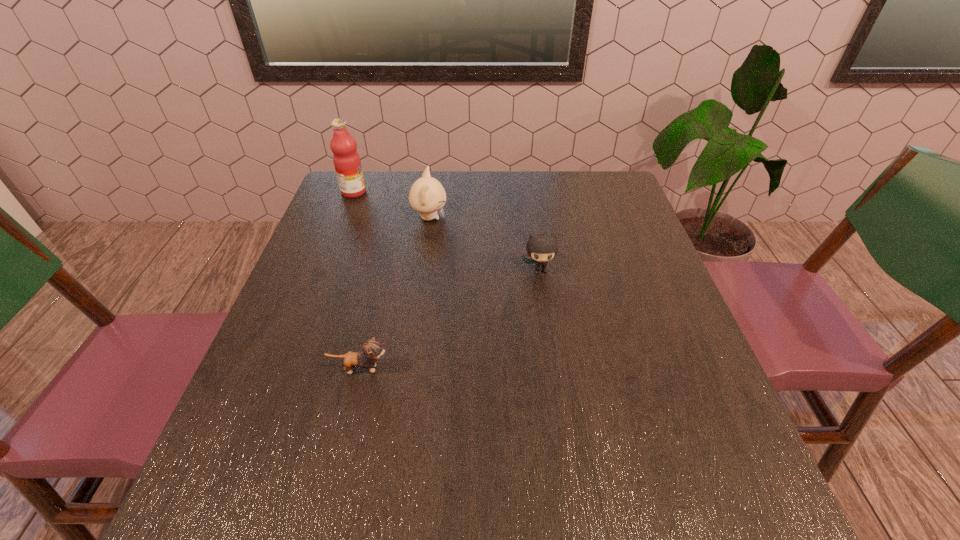
At what (x,y) coordinates should I click in order to perform the action: click on free point between the leftmost object and the nearest kitten. Please return your answer as a coordinate pair (x, y). The height and width of the screenshot is (540, 960). Looking at the image, I should click on (357, 280).

Locate an element on the screen. This screenshot has width=960, height=540. free space between the nearest kitten and the rightmost object is located at coordinates (450, 319).

The image size is (960, 540). Identify the location of vacant region between the rightmost kitten and the leftmost object. (446, 231).

You are a GUI agent. You are given a task and a screenshot of the screen. Output one action in this format:
    pyautogui.click(x=<x>, y=<y>)
    Task: Click on the empty space that is in between the tallest kitten and the nearest object
    Image resolution: width=960 pixels, height=540 pixels.
    Given the screenshot: What is the action you would take?
    pyautogui.click(x=395, y=293)

Identify which object is located as the second nearest to the farthest object. Please provide its 2D coordinates. Your answer should be formatted as a tuple, i.e. [(x, y)], where the tuple contains the x and y coordinates of a point satisfying the conditions above.

[(541, 248)]

Identify which object is the second nearest to the shortest object. Please provide its 2D coordinates. Your answer should be formatted as a tuple, i.e. [(x, y)], where the tuple contains the x and y coordinates of a point satisfying the conditions above.

[(427, 195)]

Point out which kitten is positioned as the second nearest to the second farthest object. Please provide its 2D coordinates. Your answer should be formatted as a tuple, i.e. [(x, y)], where the tuple contains the x and y coordinates of a point satisfying the conditions above.

[(372, 349)]

Choose which kitten is the third nearest neighbor to the fruit juice. Please provide its 2D coordinates. Your answer should be formatted as a tuple, i.e. [(x, y)], where the tuple contains the x and y coordinates of a point satisfying the conditions above.

[(372, 349)]

At what (x,y) coordinates should I click in order to perform the action: click on free space that satisfies the following two spatial constraints: 1. on the front-facing side of the rightmost object; 2. on the front-facing side of the shortest kitten. Please return your answer as a coordinate pair (x, y). This screenshot has width=960, height=540. Looking at the image, I should click on (554, 369).

Where is `vacant position in the image that satisfies the following two spatial constraints: 1. on the front-facing side of the second tallest kitten; 2. on the front-facing side of the nearest kitten`? The image size is (960, 540). vacant position in the image that satisfies the following two spatial constraints: 1. on the front-facing side of the second tallest kitten; 2. on the front-facing side of the nearest kitten is located at coordinates (554, 369).